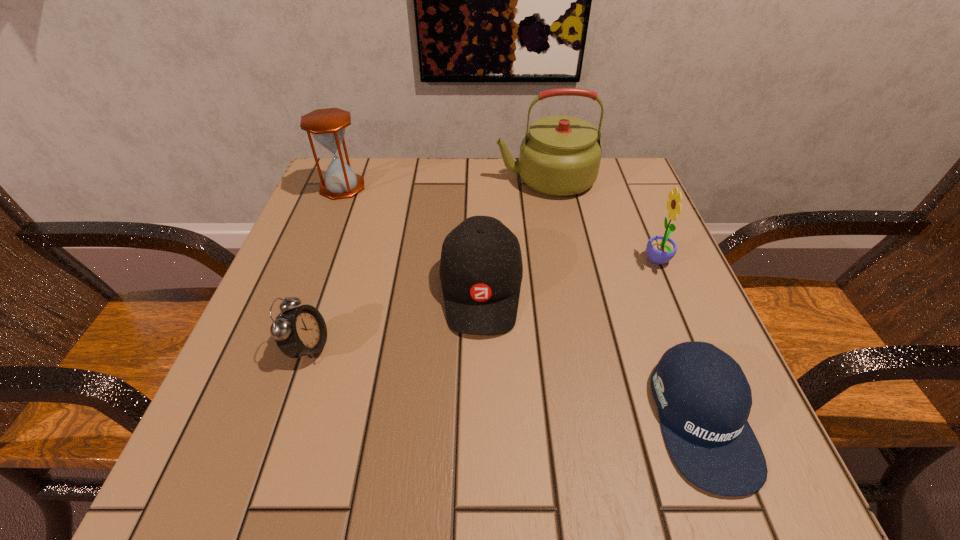
Where is `object that stands as the second closest to the hourglass`? The height and width of the screenshot is (540, 960). object that stands as the second closest to the hourglass is located at coordinates [560, 156].

Locate an element on the screen. The height and width of the screenshot is (540, 960). object that is the third closest to the kettle is located at coordinates (327, 126).

This screenshot has width=960, height=540. In order to click on blank space that satisfies the following two spatial constraints: 1. on the front-facing side of the sunflower; 2. on the front-facing side of the right baseball cap in this screenshot , I will do `click(724, 419)`.